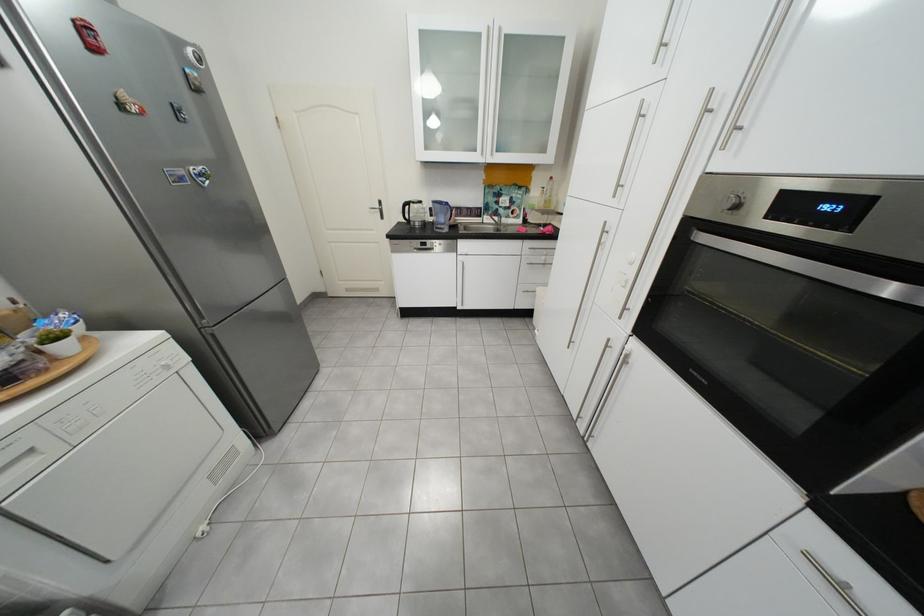
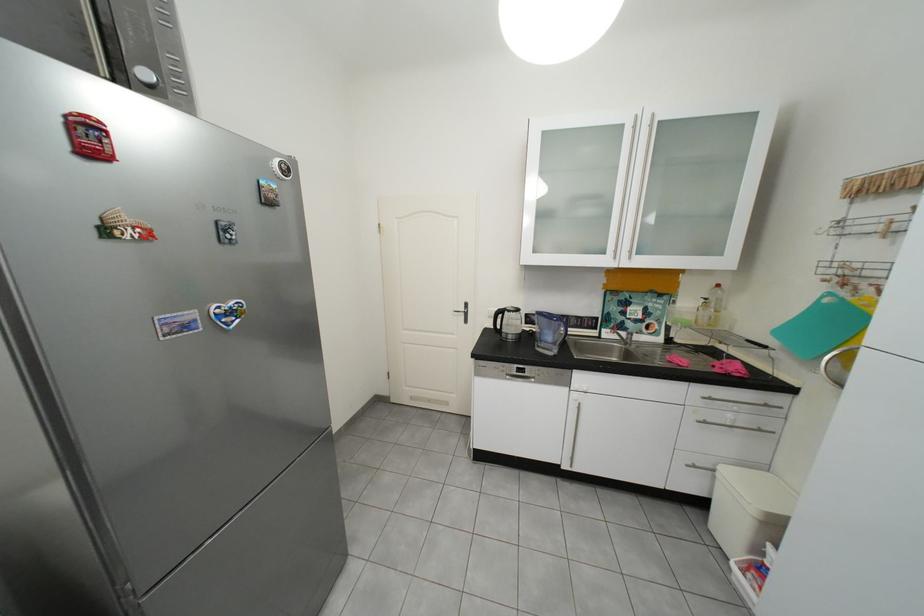
In the second image, find the point that corresponds to (499,220) in the first image.

(619, 334)